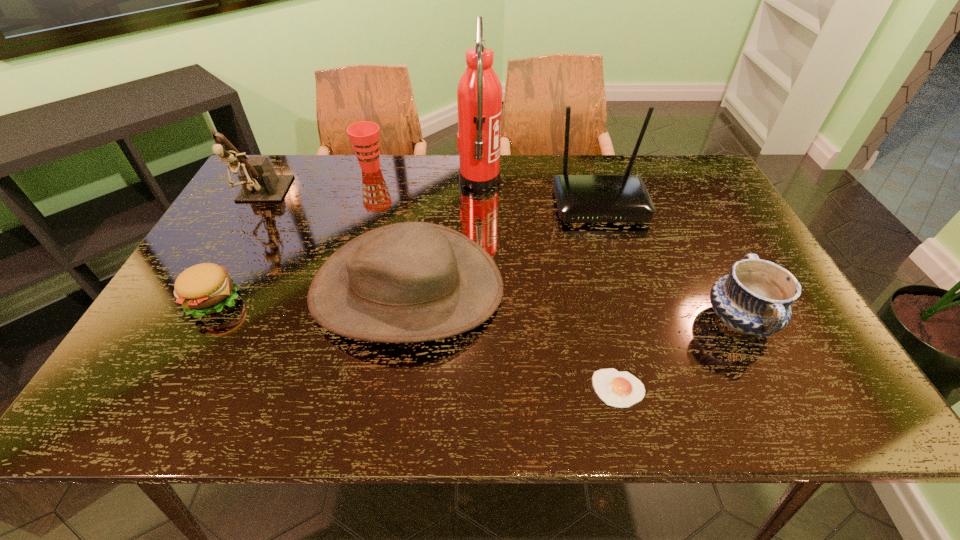
Locate an element on the screen. This screenshot has width=960, height=540. free location located 0.290m on the front-facing side of the figurine is located at coordinates (204, 296).

Identify the location of free space located on the front-facing side of the router. This screenshot has width=960, height=540. (628, 296).

Where is `blank space located on the left of the cup`? This screenshot has height=540, width=960. blank space located on the left of the cup is located at coordinates (323, 168).

The height and width of the screenshot is (540, 960). I want to click on vacant space situated on the right of the cowboy hat, so click(631, 288).

Identify the location of vacant space located on the left of the rightmost object. Image resolution: width=960 pixels, height=540 pixels. (656, 320).

Identify the location of vacant space located on the back of the hamburger. (276, 187).

At what (x,y) coordinates should I click in order to perform the action: click on free space located 0.380m on the back of the nearest object. Please return your answer as a coordinate pair (x, y). Looking at the image, I should click on (584, 247).

Where is `fire extinguisher situated at the far edge`? fire extinguisher situated at the far edge is located at coordinates (479, 94).

This screenshot has height=540, width=960. Find the location of `figurine at the far edge`. figurine at the far edge is located at coordinates (260, 183).

Where is `router that is at the far edge`? router that is at the far edge is located at coordinates (624, 198).